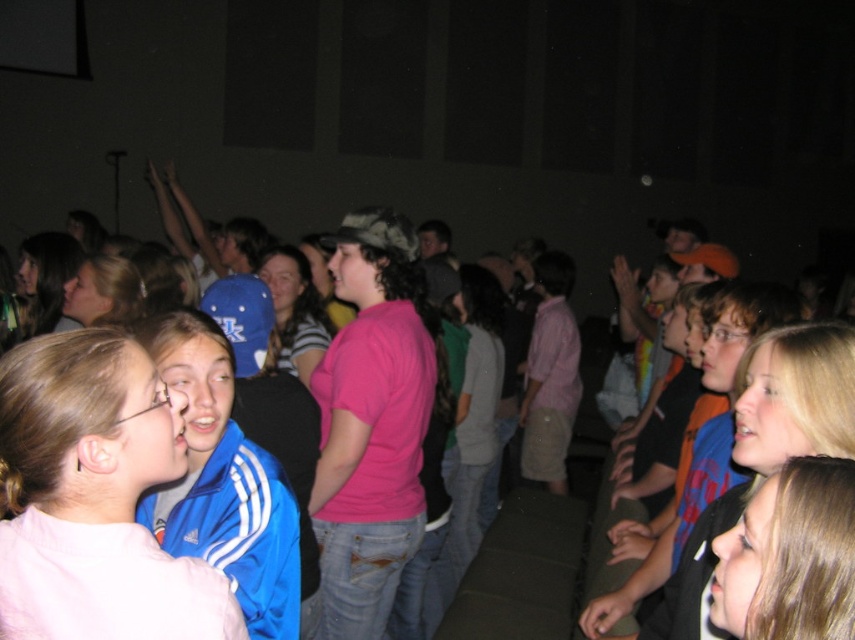
You are standing in the auditorium and want to take a photo of both the point at coordinates point (16, 566) and point (186, 536). Which point should you focus on first to ensure both are in focus?

You should focus on the point at coordinates point (16, 566) first because it is closer to the camera than point (186, 536). By focusing on the closer point, the farther point will also be within the depth of field and in focus.

In the scene shown: You are organizing a photo shoot and need to arrange two models wearing the pink matte shirt at center and the blue synthetic jacket at center. According to the scene, which model should stand to the right to maintain the original spatial relationship?

The blue synthetic jacket at center should stand to the right because the pink matte shirt at center is positioned on the left side of the blue synthetic jacket at center in the original scene.

Based on the scene description, where is the pink matte shirt at center located in terms of its 2D coordinates?

The pink matte shirt at center is located at the 2D coordinates of point (93, 497).